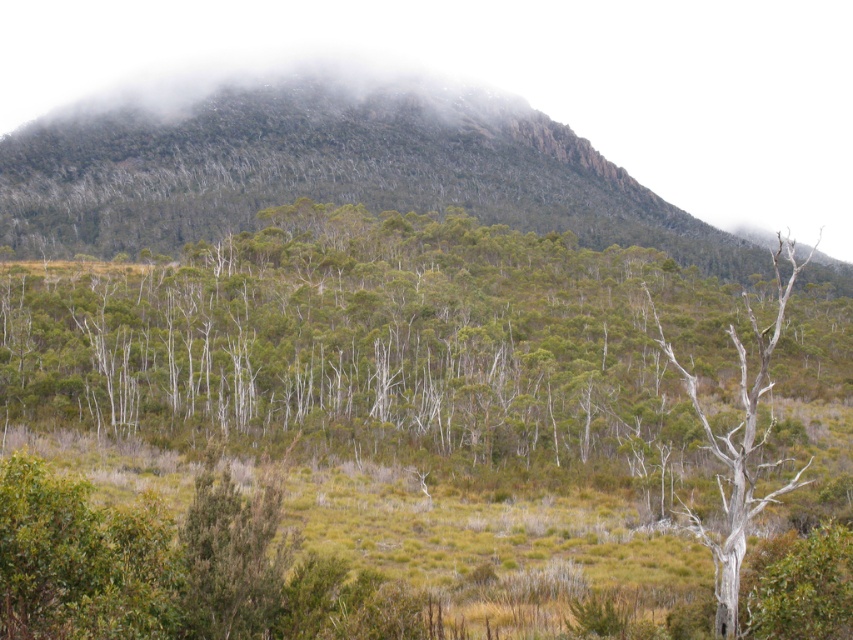
Is green leafy forest at upper center to the right of white bark birch tree at right from the viewer's perspective?

Incorrect, green leafy forest at upper center is not on the right side of white bark birch tree at right.

Can you confirm if green leafy forest at upper center is shorter than white bark birch tree at right?

Incorrect, green leafy forest at upper center's height does not fall short of white bark birch tree at right's.

Image resolution: width=853 pixels, height=640 pixels. What are the coordinates of `green leafy forest at upper center` in the screenshot? It's located at (326, 170).

Does point (15, 282) come in front of point (733, 536)?

No, it is behind (733, 536).

Who is shorter, green matte trees at center or white bark birch tree at right?

white bark birch tree at right is shorter.

Measure the distance between green matte trees at center and camera.

green matte trees at center and camera are 70.76 feet apart.

Find the location of a particular element. This screenshot has width=853, height=640. green matte trees at center is located at coordinates (376, 342).

Which is more to the left, green matte trees at center or green leafy forest at upper center?

From the viewer's perspective, green matte trees at center appears more on the left side.

Is point (447, 410) positioned after point (4, 141)?

No, it is not.

Identify the location of green matte trees at center. The width and height of the screenshot is (853, 640). (376, 342).